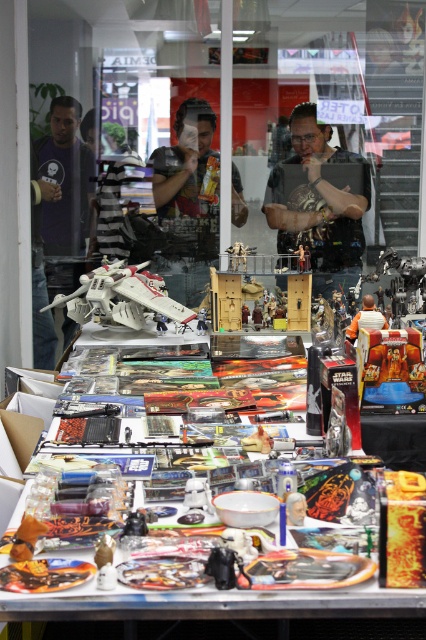
You are a customer standing in the store and want to pick up the matte purple shirt at left and the metallic silver table at center. Which item should you move towards first based on their positions?

The metallic silver table at center is to the right of the matte purple shirt at left. Since you want to pick up both items, you should first move towards the matte purple shirt at left, which is on your left side, and then proceed to the metallic silver table at center on the right side.

You are a delivery person carrying a large box that is 2 meters long. You need to place it on the metallic silver table at center. Considering the table is 2.27 meters away from you, will the box fit on the table?

The metallic silver table at center is 2.27 meters away from you, so the box that is 2 meters long will fit on the table since it is shorter than the distance to the table.

You are a photographer taking a picture of the scene. You notice two points in the image at coordinates point (328, 288) and point (77, 228). Which point is closer to the camera?

Point (77, 228) is closer to the camera than point (328, 288) because the description states that point (328, 288) is further away.